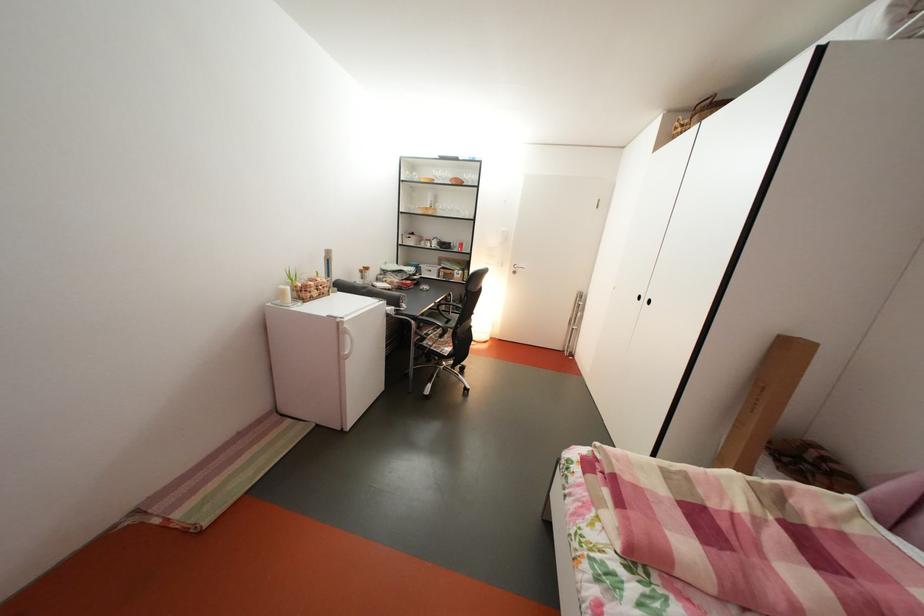
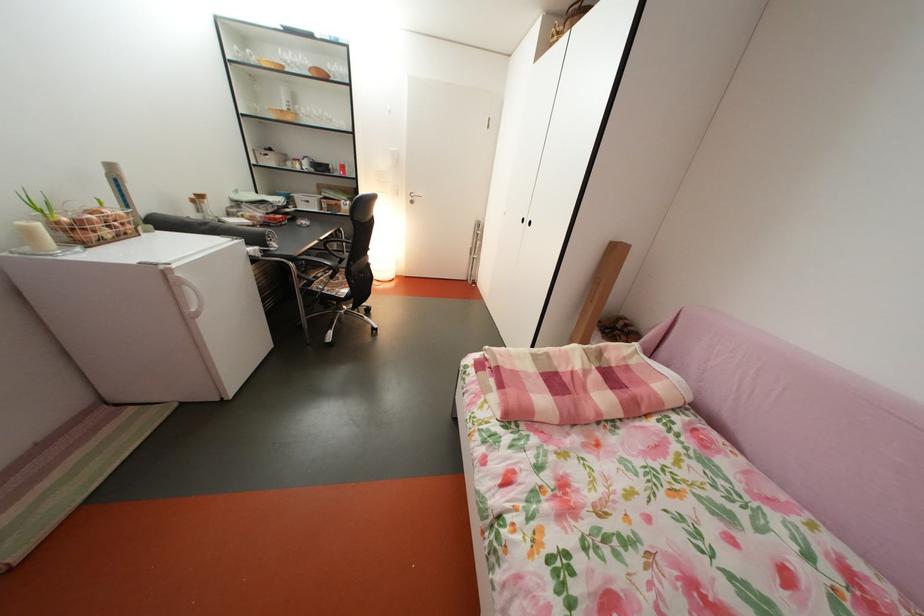
Locate, in the second image, the point that corresponds to point 442,219 in the first image.

(300, 124)